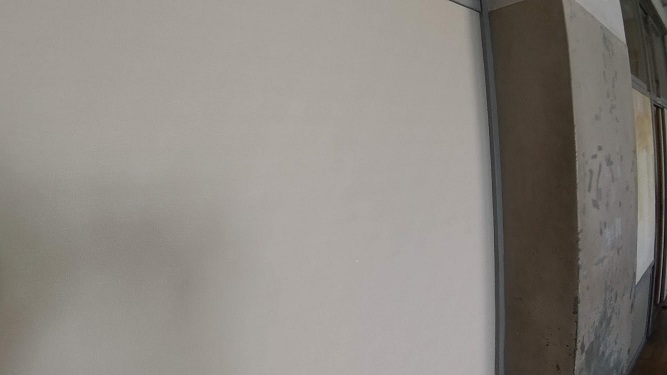
Where is `window`? The image size is (667, 375). window is located at coordinates (632, 46), (655, 53).